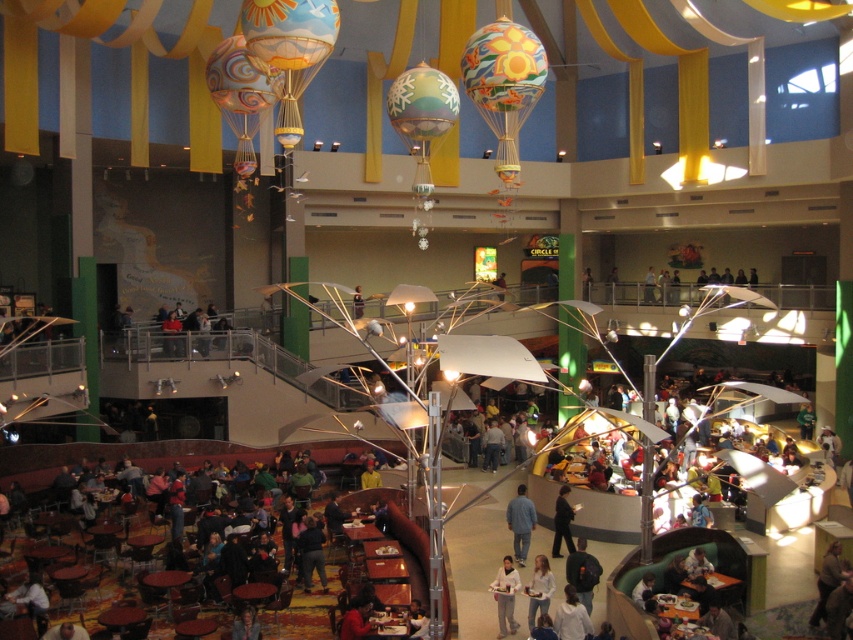
Question: Does matte yellow balloon at upper center appear over white cotton shirt at center?

Choices:
 (A) yes
 (B) no

Answer: (A)

Question: Which of the following is the closest to the observer?

Choices:
 (A) (477, 67)
 (B) (556, 516)
 (C) (579, 582)

Answer: (C)

Question: Which object is farther from the camera taking this photo?

Choices:
 (A) dark blue shirt at center
 (B) denim pants at center

Answer: (B)

Question: Is denim pants at center to the right of dark blue shirt at center from the viewer's perspective?

Choices:
 (A) no
 (B) yes

Answer: (B)

Question: Which point is closer to the camera taking this photo?

Choices:
 (A) (505, 593)
 (B) (573, 611)

Answer: (B)

Question: Does matte yellow balloon at upper center appear on the left side of light brown leather jacket at center?

Choices:
 (A) yes
 (B) no

Answer: (B)